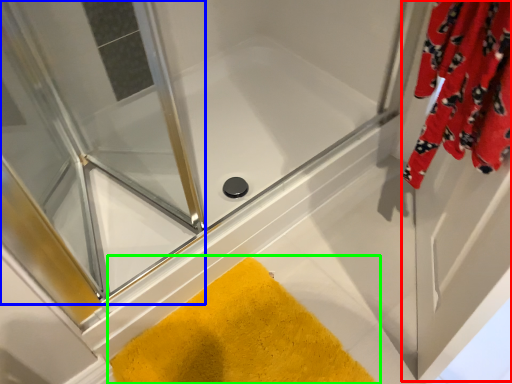
Question: Which is nearer to the screen door (highlighted by a red box)? screen door (highlighted by a blue box) or bath mat (highlighted by a green box).

Choices:
 (A) screen door
 (B) bath mat

Answer: (B)